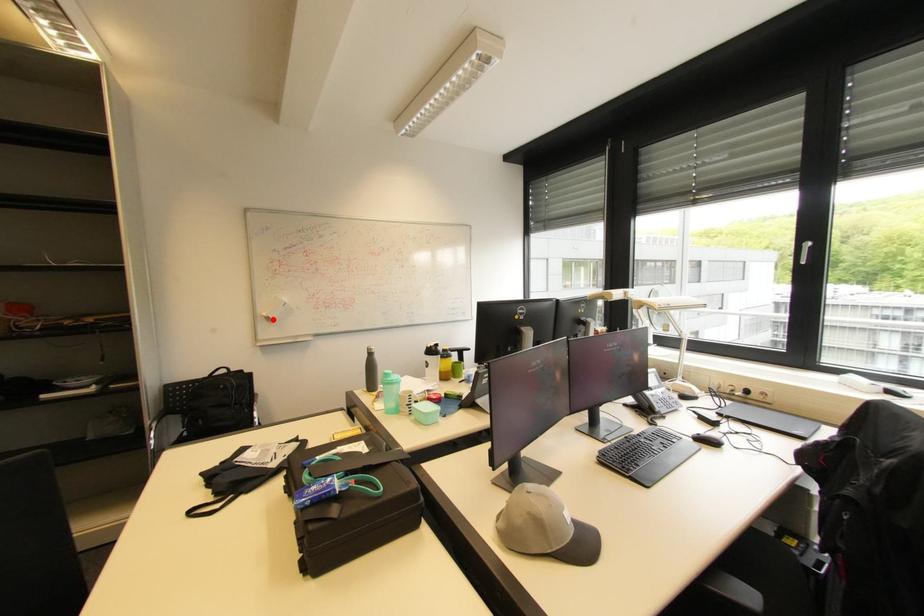
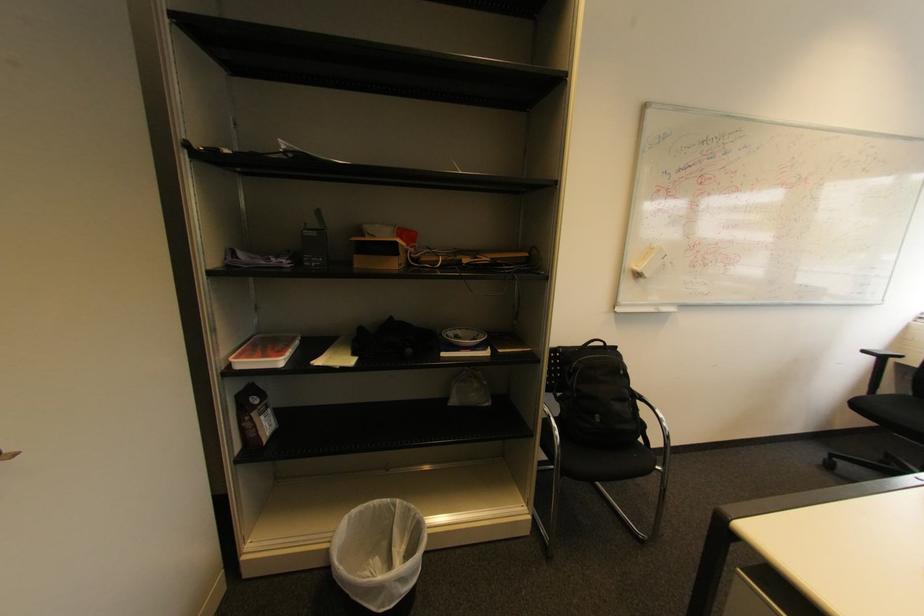
In the second image, find the point that corresponds to the highlighted location in the first image.

(643, 276)